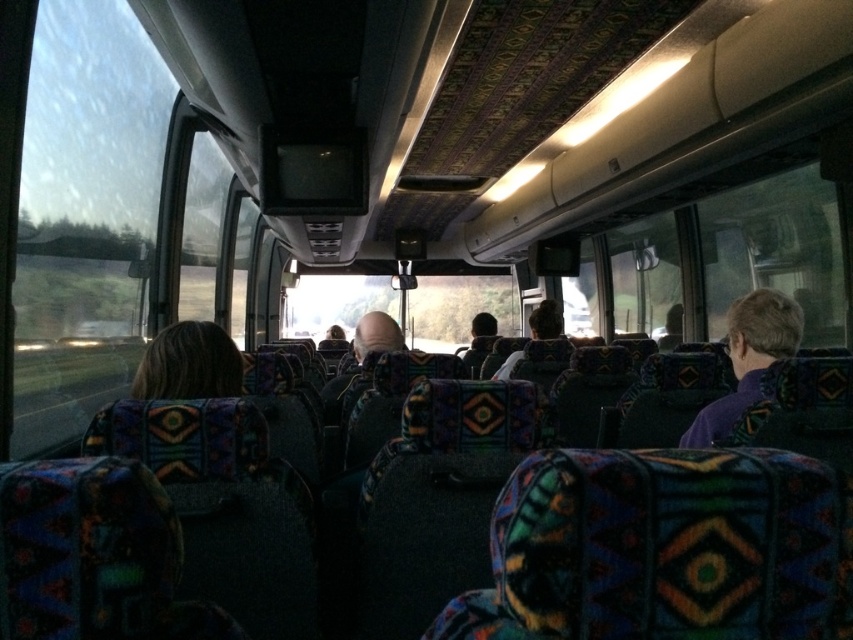
Question: Is blonde hair at center to the right of dark brown hair at center from the viewer's perspective?

Choices:
 (A) no
 (B) yes

Answer: (A)

Question: Which of the following is the closest to the observer?

Choices:
 (A) (335, 396)
 (B) (183, 324)
 (C) (549, 316)

Answer: (B)

Question: Does purple fabric at right have a lesser width compared to smooth bald head at center?

Choices:
 (A) no
 (B) yes

Answer: (B)

Question: Which object is closer to the camera taking this photo?

Choices:
 (A) smooth bald head at center
 (B) purple fabric at right
 (C) dark brown hair at center
 (D) blonde hair at center

Answer: (D)

Question: Considering the relative positions of smooth bald head at center and dark brown hair at center in the image provided, where is smooth bald head at center located with respect to dark brown hair at center?

Choices:
 (A) left
 (B) right

Answer: (A)

Question: Which point is closer to the camera taking this photo?

Choices:
 (A) (753, 362)
 (B) (363, 355)

Answer: (A)